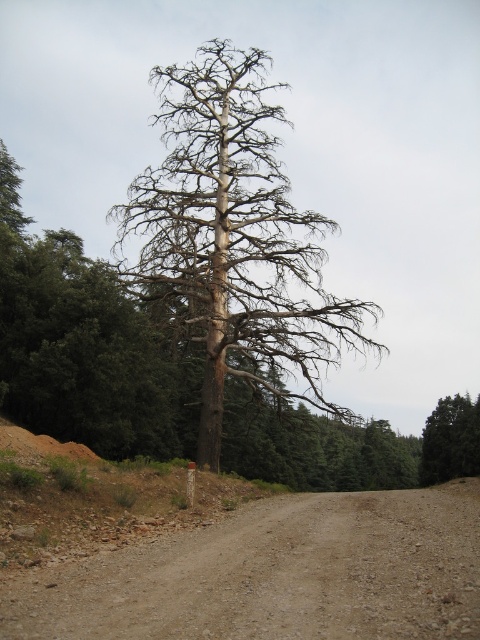
Question: Which point appears closest to the camera in this image?

Choices:
 (A) (184, 225)
 (B) (308, 612)
 (C) (475, 406)

Answer: (B)

Question: Considering the relative positions of brown gravel dirt track at center and green matte tree at center in the image provided, where is brown gravel dirt track at center located with respect to green matte tree at center?

Choices:
 (A) above
 (B) below

Answer: (A)

Question: Is bare wood tree at center to the right of green matte tree at center from the viewer's perspective?

Choices:
 (A) yes
 (B) no

Answer: (B)

Question: Among these points, which one is nearest to the camera?

Choices:
 (A) (445, 426)
 (B) (32, 600)

Answer: (B)

Question: Which object is farther from the camera taking this photo?

Choices:
 (A) bare wood tree at center
 (B) brown gravel dirt track at center

Answer: (A)

Question: Is brown gravel dirt track at center positioned at the back of green matte tree at center?

Choices:
 (A) yes
 (B) no

Answer: (B)